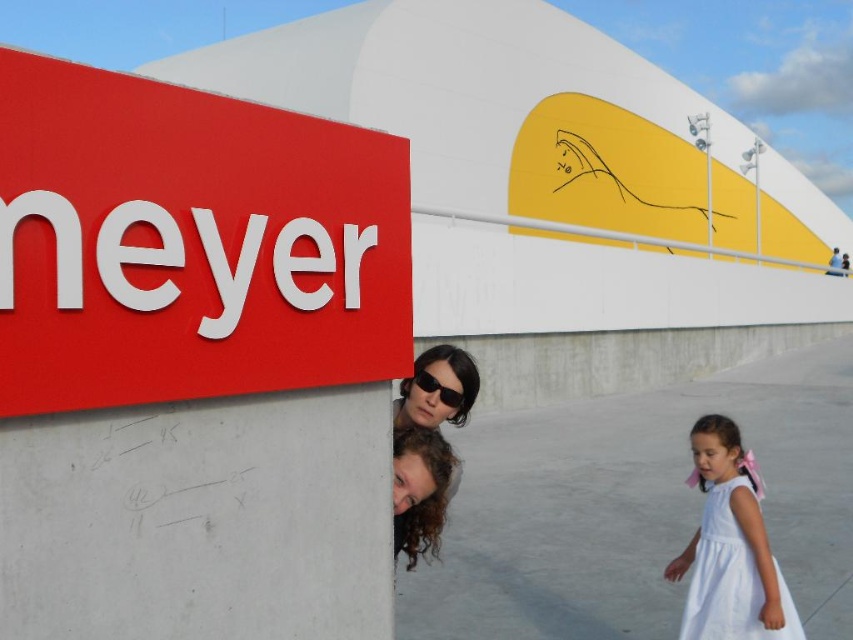
Who is more forward, (344, 248) or (664, 576)?

Point (344, 248) is in front.

Which of these two, matte white sign at upper left or white satin dress at lower right, stands shorter?

With less height is matte white sign at upper left.

Image resolution: width=853 pixels, height=640 pixels. In order to click on matte white sign at upper left in this screenshot , I will do point(189,243).

Is white satin dress at lower right taller than black plastic sunglasses at center?

Correct, white satin dress at lower right is much taller as black plastic sunglasses at center.

Can you confirm if white satin dress at lower right is wider than black plastic sunglasses at center?

Yes, white satin dress at lower right is wider than black plastic sunglasses at center.

Does point (711, 464) come behind point (430, 388)?

That is True.

This screenshot has height=640, width=853. What are the coordinates of `white satin dress at lower right` in the screenshot? It's located at tap(730, 547).

Does matte white sign at upper left have a lesser width compared to black plastic sunglasses at center?

No.

Where is `matte white sign at upper left`? This screenshot has height=640, width=853. matte white sign at upper left is located at coordinates (189, 243).